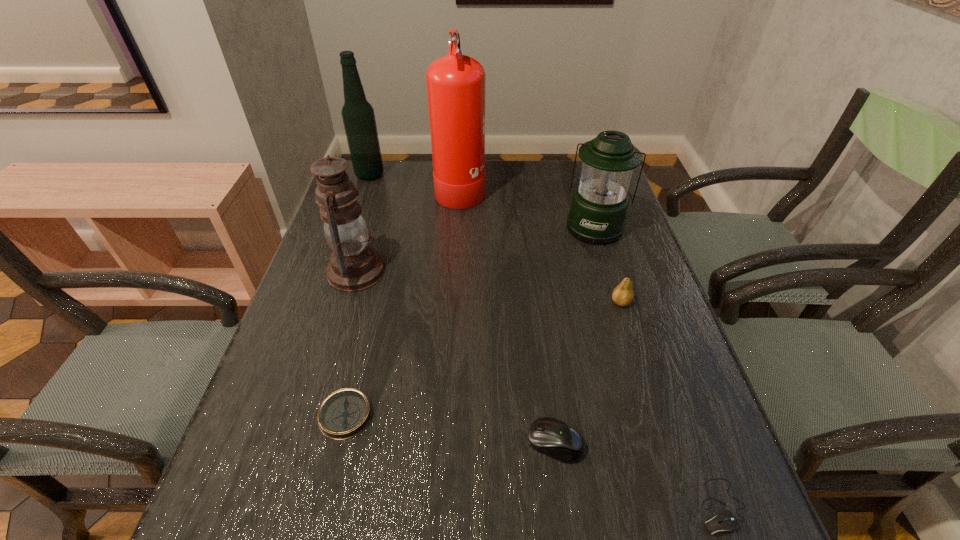
Locate an element on the screen. the right computer mouse is located at coordinates (725, 521).

This screenshot has height=540, width=960. In order to click on vacant space located 0.060m towards the nozzle of the fire extinguisher in this screenshot , I will do click(504, 187).

This screenshot has height=540, width=960. I want to click on free region located on the right of the alcohol, so click(429, 175).

Locate an element on the screen. This screenshot has height=540, width=960. vacant area situated 0.340m on the right of the oil lamp is located at coordinates (517, 272).

At what (x,y) coordinates should I click in order to perform the action: click on vacant area situated on the left of the fourth tallest object. Please return your answer as a coordinate pair (x, y). Looking at the image, I should click on (437, 226).

Where is `vacant space located on the back of the pear`? vacant space located on the back of the pear is located at coordinates [592, 212].

Where is `vacant space located 0.220m on the left of the farther computer mouse`? Image resolution: width=960 pixels, height=540 pixels. vacant space located 0.220m on the left of the farther computer mouse is located at coordinates (407, 443).

Locate an element on the screen. This screenshot has width=960, height=540. free space located on the back of the compass is located at coordinates (368, 323).

Find the location of a particular element. The height and width of the screenshot is (540, 960). vacant space situated 0.140m on the left of the nearer computer mouse is located at coordinates (612, 507).

The height and width of the screenshot is (540, 960). I want to click on fire extinguisher at the far edge, so click(x=455, y=83).